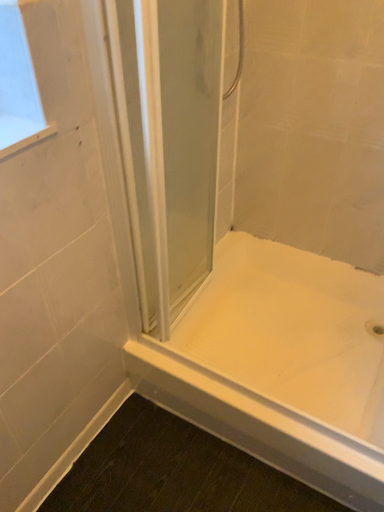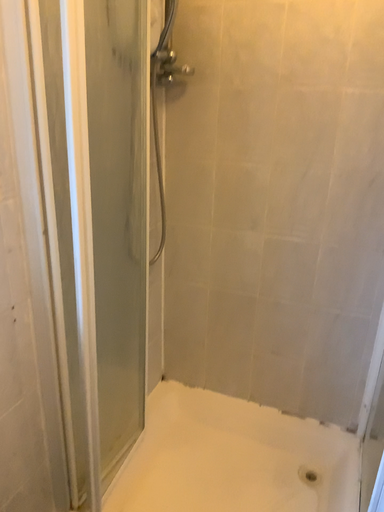
Question: How did the camera likely rotate when shooting the video?

Choices:
 (A) rotated left
 (B) rotated right

Answer: (B)